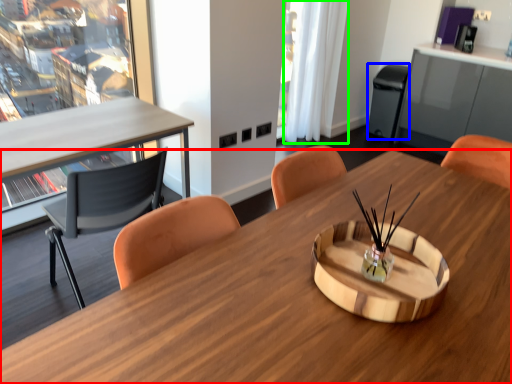
Question: Based on their relative distances, which object is nearer to desk (highlighted by a red box)? Choose from trash bin/can (highlighted by a blue box) and curtain (highlighted by a green box).

Choices:
 (A) trash bin/can
 (B) curtain

Answer: (B)